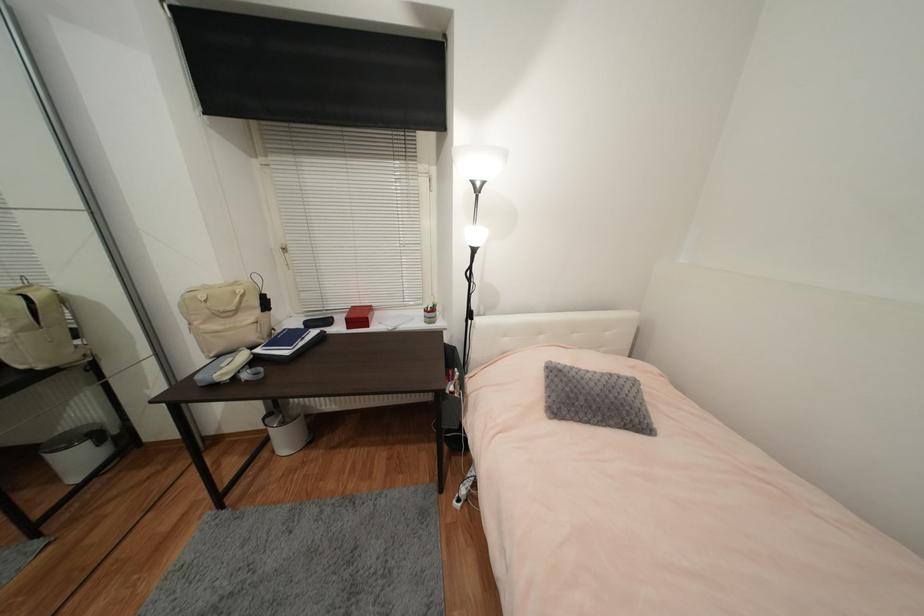
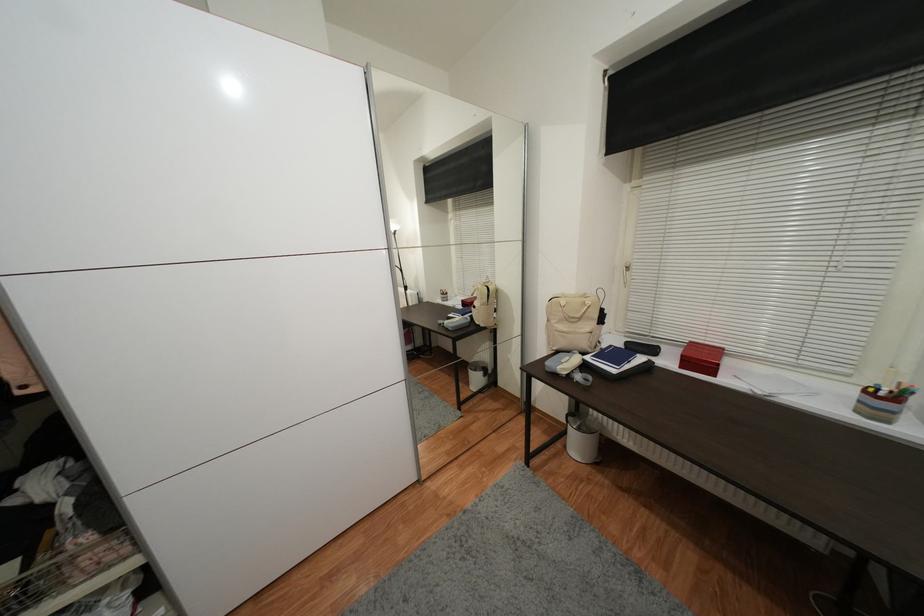
Find the pixel in the second image that matches point (363, 318) in the first image.

(706, 361)